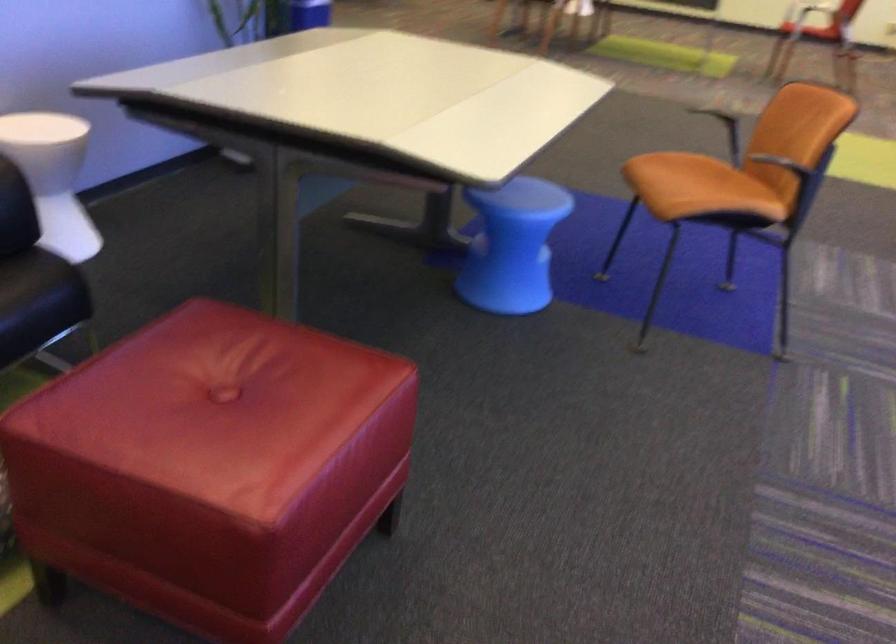
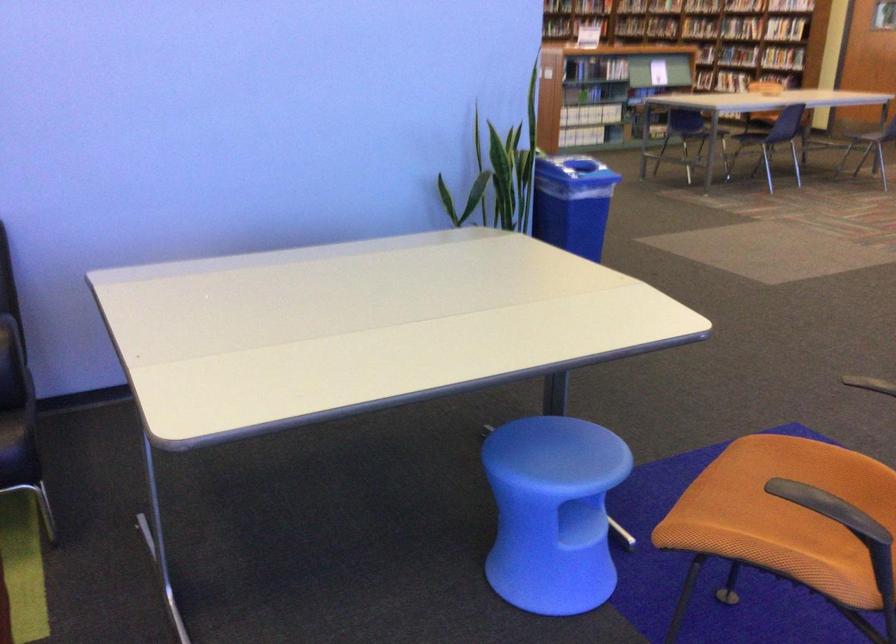
In the second image, find the point that corresponds to point 526,196 in the first image.

(560, 453)